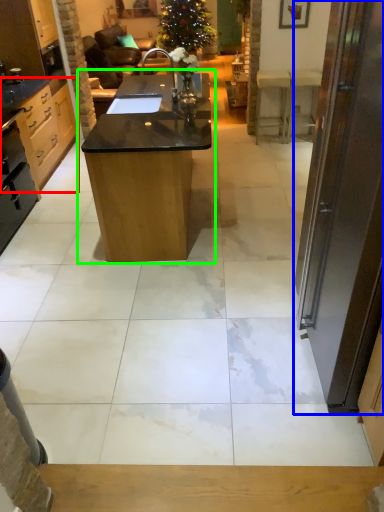
Question: Considering the real-world distances, which object is closest to cabinetry (highlighted by a red box)? door (highlighted by a blue box) or table (highlighted by a green box).

Choices:
 (A) door
 (B) table

Answer: (B)